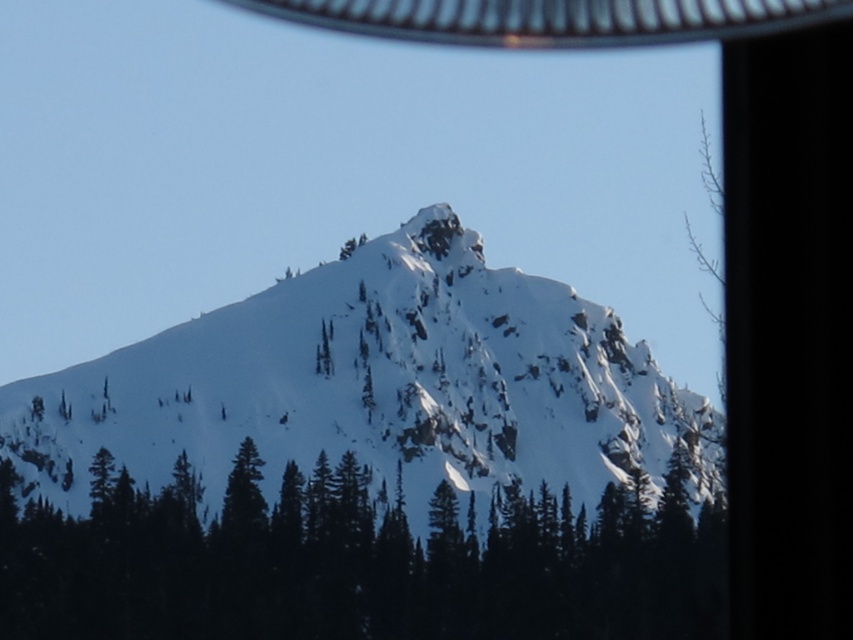
What do you see at coordinates (375, 385) in the screenshot? The width and height of the screenshot is (853, 640). I see `white snow-covered mountain at center` at bounding box center [375, 385].

Between white snow-covered mountain at center and green matte tree at center, which one is positioned higher?

white snow-covered mountain at center

Between point (218, 451) and point (59, 576), which one is positioned in front?

Point (59, 576)

Where is `white snow-covered mountain at center`? white snow-covered mountain at center is located at coordinates (375, 385).